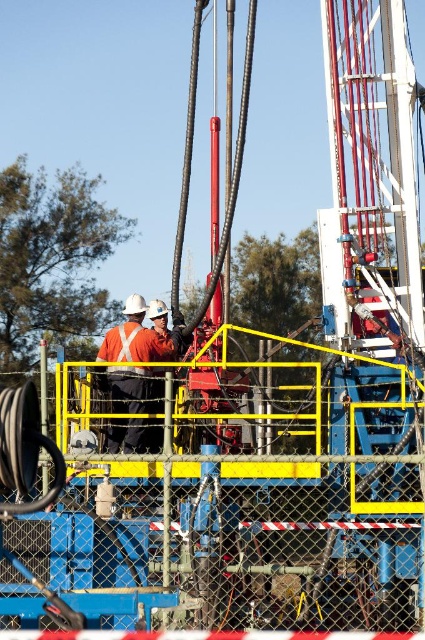
What are the coordinates of the orange reflective vest at center in the image?

The orange reflective vest at center is located at coordinates point (138,337).